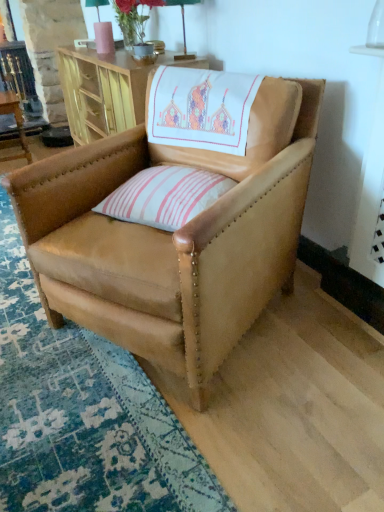
Find the location of `free spot below wooden table at left, the 1th table from the left (from a real-world perspective)`. free spot below wooden table at left, the 1th table from the left (from a real-world perspective) is located at coordinates (13, 162).